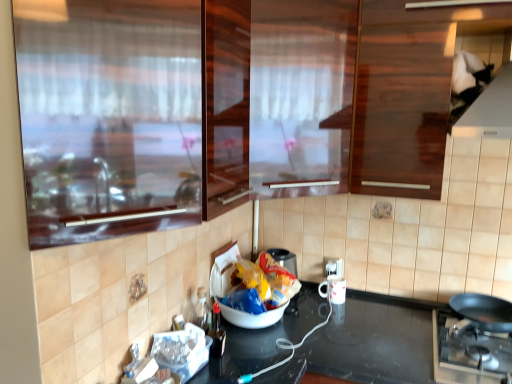
Question: From a real-world perspective, is black matte pan at lower right below white plastic electric outlet at lower right?

Choices:
 (A) no
 (B) yes

Answer: (B)

Question: Considering the relative positions of black matte pan at lower right and white plastic electric outlet at lower right in the image provided, is black matte pan at lower right to the left of white plastic electric outlet at lower right from the viewer's perspective?

Choices:
 (A) yes
 (B) no

Answer: (B)

Question: Is black matte pan at lower right at the right side of white plastic electric outlet at lower right?

Choices:
 (A) no
 (B) yes

Answer: (B)

Question: Is black matte pan at lower right not close to white plastic electric outlet at lower right?

Choices:
 (A) yes
 (B) no

Answer: (B)

Question: Is black matte pan at lower right closer to camera compared to white plastic electric outlet at lower right?

Choices:
 (A) yes
 (B) no

Answer: (A)

Question: Does black matte pan at lower right contain white plastic electric outlet at lower right?

Choices:
 (A) yes
 (B) no

Answer: (B)

Question: Does transparent glass door at upper left, positioned as the 1th glass door in front-to-back order, appear on the left side of black matte pan at lower right?

Choices:
 (A) no
 (B) yes

Answer: (B)

Question: Is transparent glass door at upper left, positioned as the 1th glass door in front-to-back order, further to the viewer compared to black matte pan at lower right?

Choices:
 (A) no
 (B) yes

Answer: (A)

Question: From a real-world perspective, is transparent glass door at upper left, which ranks as the second glass door in back-to-front order, below black matte pan at lower right?

Choices:
 (A) no
 (B) yes

Answer: (A)

Question: Could you tell me if transparent glass door at upper left, positioned as the 1th glass door in front-to-back order, is facing black matte pan at lower right?

Choices:
 (A) yes
 (B) no

Answer: (B)

Question: Considering the relative sizes of transparent glass door at upper left, positioned as the 1th glass door in front-to-back order, and black matte pan at lower right in the image provided, is transparent glass door at upper left, positioned as the 1th glass door in front-to-back order, thinner than black matte pan at lower right?

Choices:
 (A) no
 (B) yes

Answer: (B)

Question: Is transparent glass door at upper left, positioned as the 1th glass door in front-to-back order, outside of black matte pan at lower right?

Choices:
 (A) yes
 (B) no

Answer: (A)

Question: Is white plastic electric outlet at lower right thinner than white glossy mug at lower center?

Choices:
 (A) yes
 (B) no

Answer: (A)